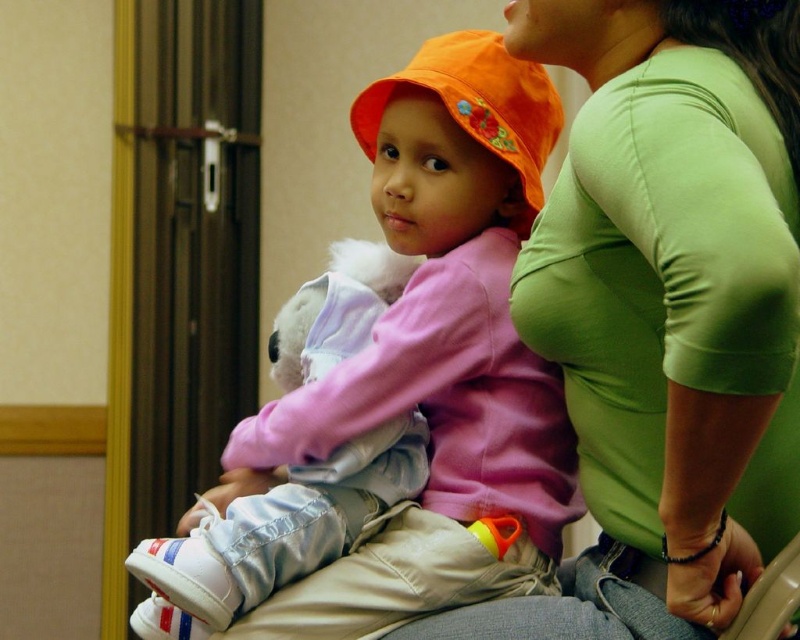
You are an interior designer assessing the seating arrangement in a waiting room. You notice the green matte shirt at upper right and the matte pink sweater at center. Which object takes up more horizontal space in the image?

The matte pink sweater at center takes up more horizontal space than the green matte shirt at upper right because the green matte shirt at upper right has a lesser width compared to matte pink sweater at center.